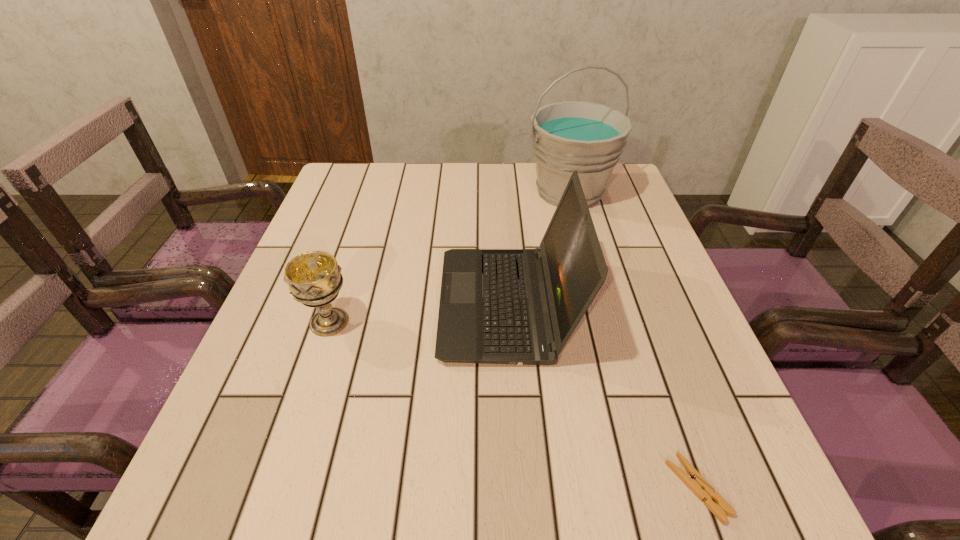
Identify the location of vacant space that satisfies the following two spatial constraints: 1. on the back side of the clothespin; 2. on the screen of the third shortest object. Image resolution: width=960 pixels, height=540 pixels. (634, 305).

Find the location of a particular element. free space that satisfies the following two spatial constraints: 1. on the back side of the second shortest object; 2. on the right side of the tallest object is located at coordinates (372, 192).